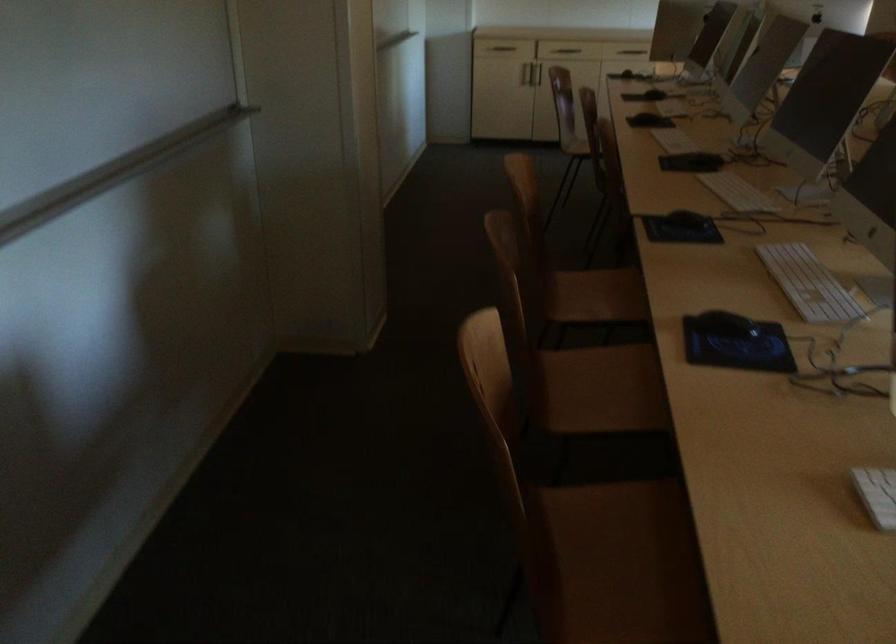
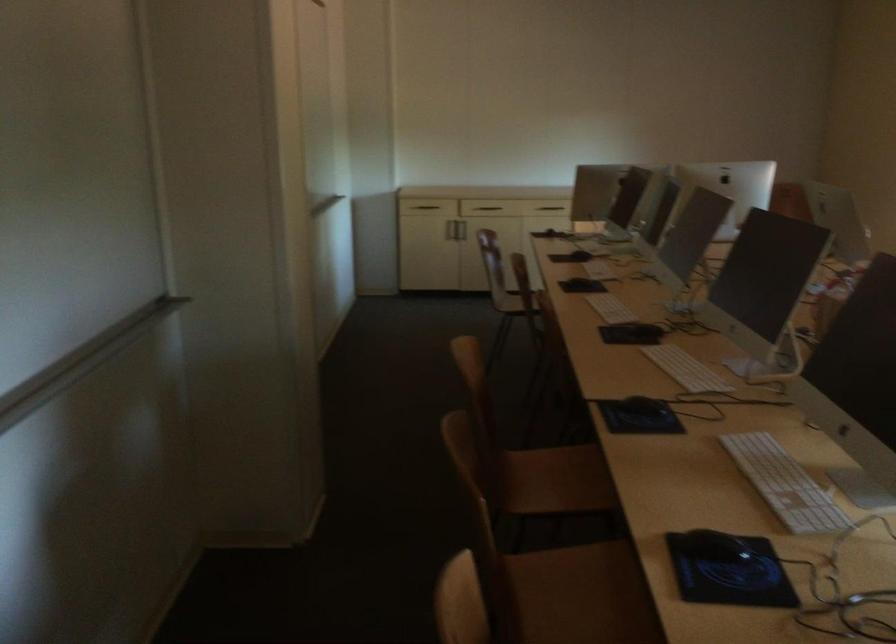
The point at (669,86) is marked in the first image. Where is the corresponding point in the second image?

(593, 245)